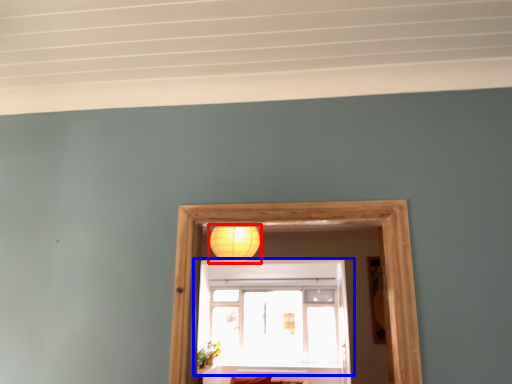
Question: Which point is closer to the camera, lamp (highlighted by a red box) or window (highlighted by a blue box)?

Choices:
 (A) lamp
 (B) window

Answer: (A)